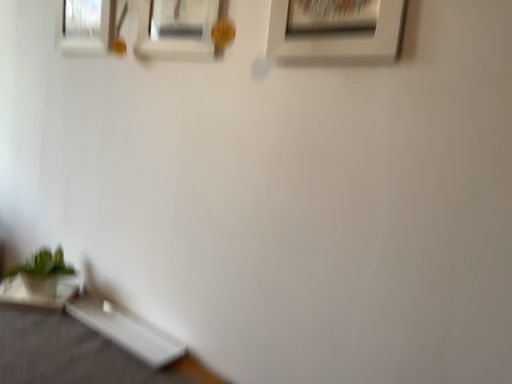
Question: From the image's perspective, is green matte plant at lower left above or below white glossy table at lower left, the 1th table positioned from the right?

Choices:
 (A) below
 (B) above

Answer: (B)

Question: In the image, is green matte plant at lower left on the left side or the right side of white glossy table at lower left, the 1th table positioned from the right?

Choices:
 (A) right
 (B) left

Answer: (B)

Question: Which object is positioned farthest from the white matte picture frame at upper center, acting as the first picture frame starting from the front?

Choices:
 (A) matte glass picture frame at upper left, placed as the 1th picture frame when sorted from back to front
 (B) white glossy table at lower left, which ranks as the 2th table in right-to-left order
 (C) white matte picture frame at upper center, marked as the 2th picture frame in a left-to-right arrangement
 (D) green matte plant at lower left
 (E) white glossy table at lower left, which appears as the second table when viewed from the left

Answer: (D)

Question: Which object is the farthest from the white glossy table at lower left, the 1th table positioned from the right?

Choices:
 (A) matte glass picture frame at upper left, placed as the 1th picture frame when sorted from back to front
 (B) white matte picture frame at upper center, arranged as the 2th picture frame when viewed from the right
 (C) green matte plant at lower left
 (D) white glossy table at lower left, the 1th table from the left
 (E) white matte picture frame at upper center, marked as the 1th picture frame in a right-to-left arrangement

Answer: (E)